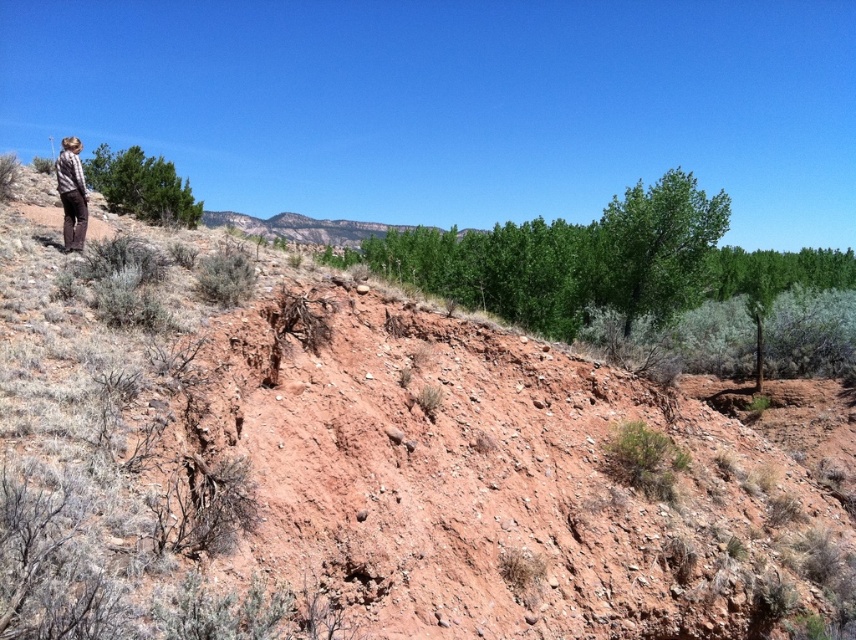
Between point (138, 168) and point (70, 147), which one is positioned in front?

Positioned in front is point (70, 147).

Locate an element on the screen. This screenshot has height=640, width=856. green leafy tree at upper left is located at coordinates (141, 186).

Who is more distant from viewer, [161,157] or [58,176]?

The point [161,157] is behind.

The image size is (856, 640). I want to click on green leafy tree at upper left, so (141, 186).

Is green leafy tree at upper right further to the viewer compared to green leafy tree at upper left?

That is True.

Between green leafy tree at upper right and green leafy tree at upper left, which one appears on the right side from the viewer's perspective?

From the viewer's perspective, green leafy tree at upper right appears more on the right side.

Is point (626, 192) farther from camera compared to point (141, 198)?

Yes.

Where is `green leafy tree at upper right`? The height and width of the screenshot is (640, 856). green leafy tree at upper right is located at coordinates (657, 248).

Is green leafy tree at upper right thinner than plaid shirt at left?

In fact, green leafy tree at upper right might be wider than plaid shirt at left.

Based on the photo, is green leafy tree at upper right positioned before plaid shirt at left?

No, green leafy tree at upper right is further to the viewer.

Between point (642, 252) and point (80, 209), which one is positioned behind?

The point (642, 252) is behind.

At what (x,y) coordinates should I click in order to perform the action: click on green leafy tree at upper right. Please return your answer as a coordinate pair (x, y). The image size is (856, 640). Looking at the image, I should click on (657, 248).